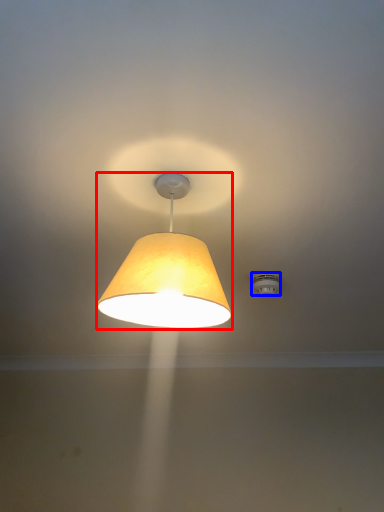
Question: Among these objects, which one is nearest to the camera, lamp (highlighted by a red box) or lighting (highlighted by a blue box)?

Choices:
 (A) lamp
 (B) lighting

Answer: (A)